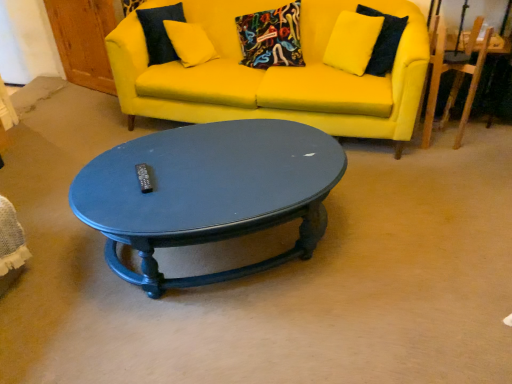
Locate an element on the screen. The height and width of the screenshot is (384, 512). unoccupied region to the right of glossy dark blue coffee table at center is located at coordinates (411, 242).